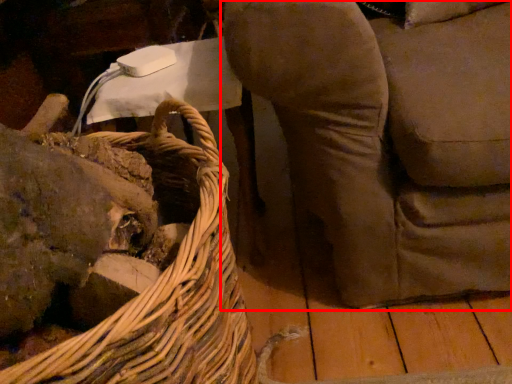
Question: Where is furniture (annotated by the red box) located in relation to picnic basket in the image?

Choices:
 (A) left
 (B) right

Answer: (B)